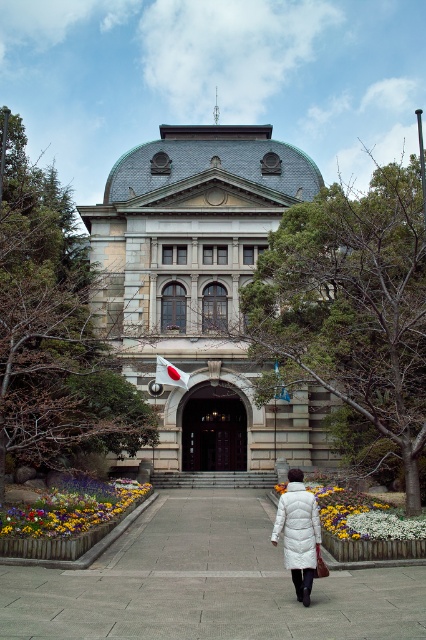
Question: Where is gray concrete pavement at center located in relation to floral carpet at center in the image?

Choices:
 (A) below
 (B) above

Answer: (A)

Question: Can you confirm if gray concrete pavement at center is positioned to the right of white down coat at center?

Choices:
 (A) yes
 (B) no

Answer: (B)

Question: Which object appears closest to the camera in this image?

Choices:
 (A) gray concrete pavement at center
 (B) floral carpet at center
 (C) vivid floral bed at lower center
 (D) white fabric flag at center

Answer: (A)

Question: Which point is farther from the camera taking this photo?

Choices:
 (A) (89, 493)
 (B) (305, 515)
 (C) (328, 637)

Answer: (A)

Question: Which point is closer to the camera?

Choices:
 (A) (356, 532)
 (B) (298, 502)

Answer: (B)

Question: Is brown wooden door at center above white down coat at center?

Choices:
 (A) no
 (B) yes

Answer: (B)